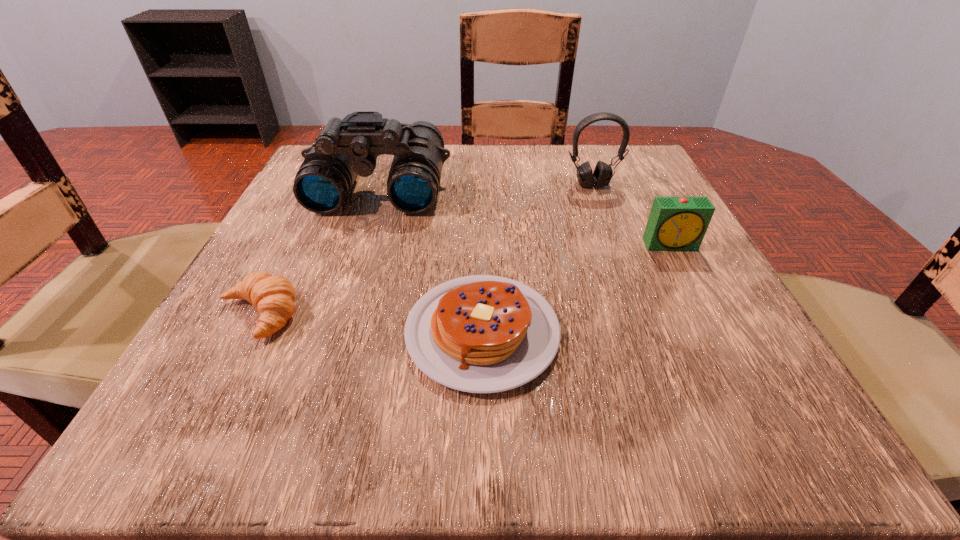
What are the coordinates of `free space between the alarm clock and the binoculars` in the screenshot? It's located at [525, 215].

The image size is (960, 540). In order to click on free space between the binoculars and the pancake in this screenshot , I will do `click(431, 259)`.

At what (x,y) coordinates should I click in order to perform the action: click on free spot between the crescent roll and the pancake. Please return your answer as a coordinate pair (x, y). The width and height of the screenshot is (960, 540). Looking at the image, I should click on (371, 323).

The image size is (960, 540). Find the location of `vacant space that's between the crescent roll and the pancake`. vacant space that's between the crescent roll and the pancake is located at coordinates (371, 323).

This screenshot has height=540, width=960. In order to click on vacant region between the pancake and the binoculars in this screenshot , I will do `click(431, 259)`.

At what (x,y) coordinates should I click in order to perform the action: click on vacant point located between the headset and the third farthest object. Please return your answer as a coordinate pair (x, y). This screenshot has width=960, height=540. Looking at the image, I should click on (632, 215).

You are a GUI agent. You are given a task and a screenshot of the screen. Output one action in this format:
    pyautogui.click(x=<x>, y=<y>)
    Task: Click on the unoccupied area between the headset and the crescent roll
    Image resolution: width=960 pixels, height=540 pixels.
    Given the screenshot: What is the action you would take?
    pyautogui.click(x=425, y=249)

Identify which object is located as the second nearest to the binoculars. Please provide its 2D coordinates. Your answer should be formatted as a tuple, i.e. [(x, y)], where the tuple contains the x and y coordinates of a point satisfying the conditions above.

[(274, 296)]

Where is `object identified as the closest to the crescent roll`? This screenshot has height=540, width=960. object identified as the closest to the crescent roll is located at coordinates (480, 334).

Identify the location of vacant space that satisfies the following two spatial constraints: 1. through the lenses of the pancake; 2. on the left side of the binoculars. (331, 332).